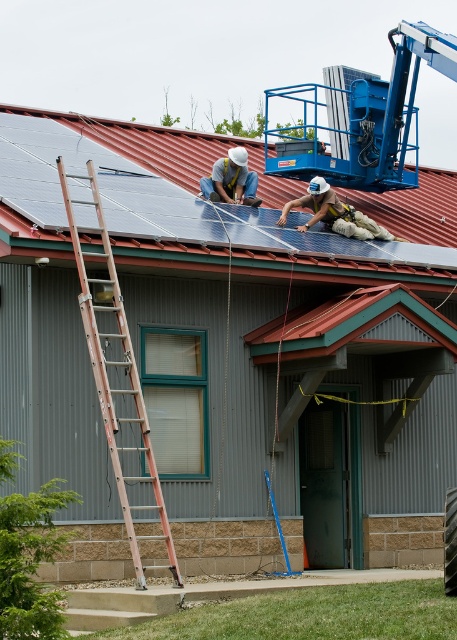
You are a safety inspector checking the solar panel installation site. You notice the metallic solar panels at upper center and the orange metallic ladder at left. Which object is larger in size?

The metallic solar panels at upper center are larger than the orange metallic ladder at left.

You are standing on the ground looking at the building with the red corrugated metal roof. You need to reach the metallic solar panels at upper center to inspect them. What is the vertical distance you need to cover to reach them?

The metallic solar panels at upper center are 29.45 meters away from the viewer, so the vertical distance you need to cover to reach them is approximately 29.45 meters.